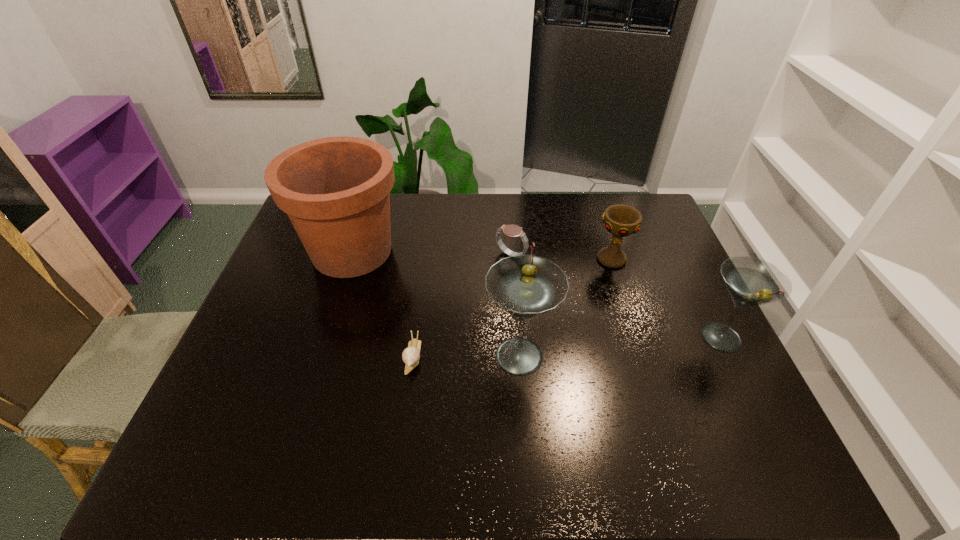
In the image, there is a desktop. Where is `vacant space at the far edge`? vacant space at the far edge is located at coordinates (479, 210).

At what (x,y) coordinates should I click in order to perform the action: click on free space at the near edge of the desktop. Please return your answer as a coordinate pair (x, y). This screenshot has width=960, height=540. Looking at the image, I should click on (434, 419).

I want to click on free region at the left edge of the desktop, so click(290, 344).

This screenshot has width=960, height=540. I want to click on vacant space at the right edge, so click(676, 316).

This screenshot has width=960, height=540. In order to click on vacant area that lies between the fifth tallest object and the escargot in this screenshot , I will do `click(462, 306)`.

Locate an element on the screen. free spot between the escargot and the shorter martini is located at coordinates (567, 347).

Where is `vacant space in between the third tallest object and the left martini`? The height and width of the screenshot is (540, 960). vacant space in between the third tallest object and the left martini is located at coordinates (620, 346).

Identify the location of vacant area that lies between the fourth shortest object and the second object from left to right. (567, 347).

Image resolution: width=960 pixels, height=540 pixels. I want to click on vacant point located between the shorter martini and the escargot, so click(567, 347).

What are the coordinates of `free space between the second shortest object and the fifth object from left to right` in the screenshot? It's located at (562, 257).